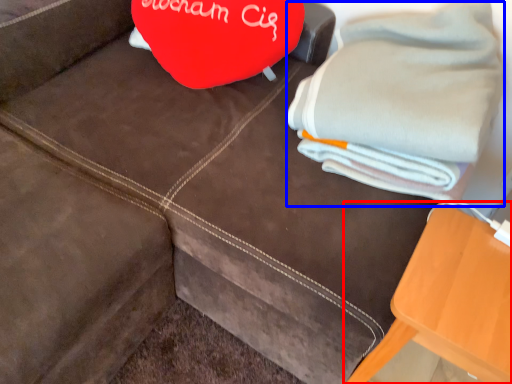
Question: Which object appears closest to the camera in this image, furniture (highlighted by a red box) or bath towel (highlighted by a blue box)?

Choices:
 (A) furniture
 (B) bath towel

Answer: (A)